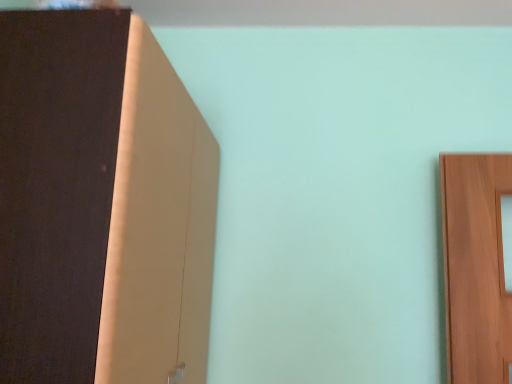
Where is `matte brown cupboard at left`? This screenshot has height=384, width=512. matte brown cupboard at left is located at coordinates (101, 204).

This screenshot has height=384, width=512. What do you see at coordinates (101, 204) in the screenshot?
I see `matte brown cupboard at left` at bounding box center [101, 204].

The image size is (512, 384). In order to click on matte brown cupboard at left in this screenshot , I will do `click(101, 204)`.